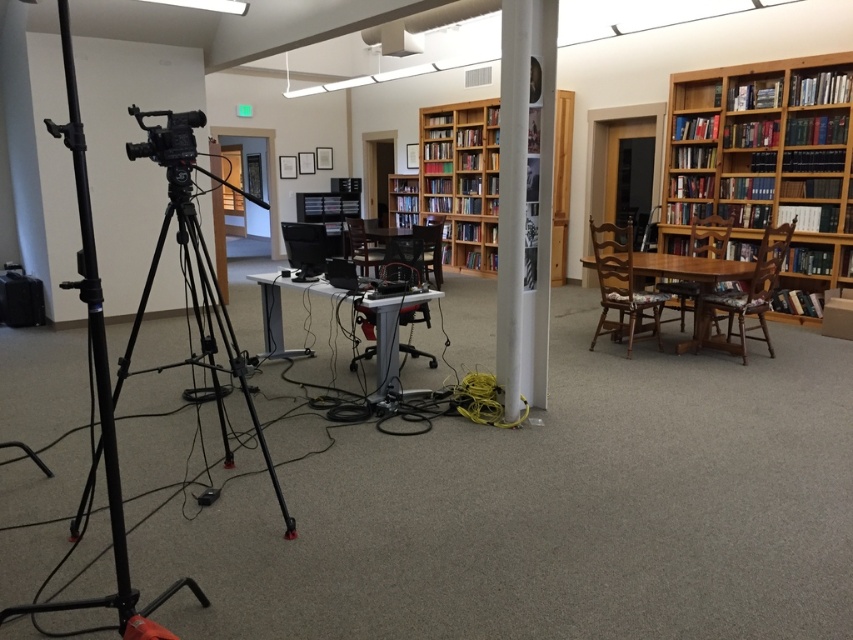
Is point (688, 131) positioned behind point (212, 301)?

Yes, it is.

Which is in front, point (703, 124) or point (207, 312)?

Point (207, 312) is in front.

The image size is (853, 640). In order to click on wooden bookcase at right in this screenshot , I will do `click(764, 160)`.

The image size is (853, 640). I want to click on wooden bookcase at right, so click(x=764, y=160).

Is black matte tripod at left shorter than matte black video camera at left?

No.

Locate an element on the screen. The height and width of the screenshot is (640, 853). black matte tripod at left is located at coordinates (200, 314).

Where is `black matte tripod at left`? black matte tripod at left is located at coordinates (200, 314).

From the picture: Can you confirm if wooden bookcase at right is positioned above wooden bookshelf at center?

No.

Locate an element on the screen. wooden bookcase at right is located at coordinates (764, 160).